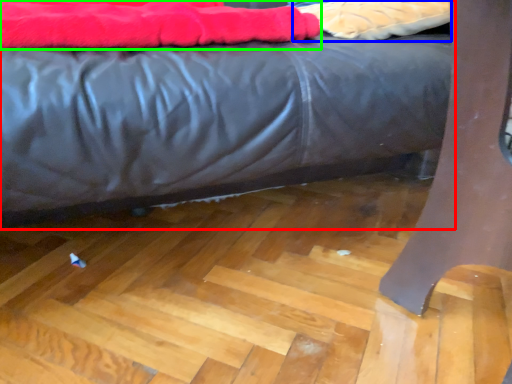
Question: Based on their relative distances, which object is nearer to bed (highlighted by a red box)? Choose from material (highlighted by a blue box) and blanket (highlighted by a green box).

Choices:
 (A) material
 (B) blanket

Answer: (B)